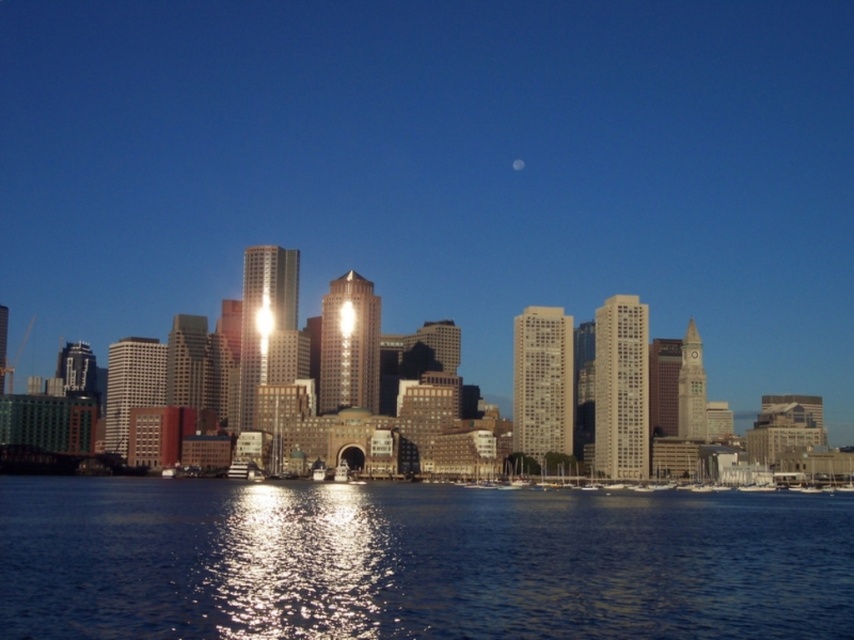
You are a photographer planning to capture the city skyline with both the shiny blue water at lower center and the silvery metallic moon at center in your shot. Which object will occupy more horizontal space in your photograph?

The shiny blue water at lower center will occupy more horizontal space in the photograph because its width surpasses that of the silvery metallic moon at center.

You are standing on a pier in the city and see the shiny blue water at lower center and the silvery metallic moon at center. If you want to throw a stone to hit both objects, which one should you aim for first, the one closer to you or the one further away?

The shiny blue water at lower center is 68.55 meters away from the silvery metallic moon at center. Since the shiny blue water at lower center is closer to you than the silvery metallic moon at center, you should aim for the shiny blue water at lower center first.

You are an astronaut floating in space and looking at the Earth. You see the shiny blue water at lower center and the silvery metallic moon at center. Which object is closer to you?

The shiny blue water at lower center is closer to you because it is in front of the silvery metallic moon at center.